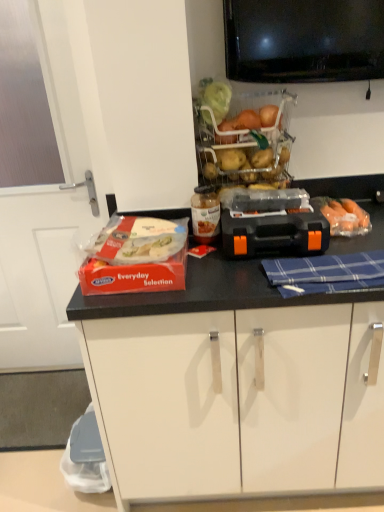
The width and height of the screenshot is (384, 512). Identify the location of blank space situated above black plastic toolbox at center (from a real-world perspective). (271, 212).